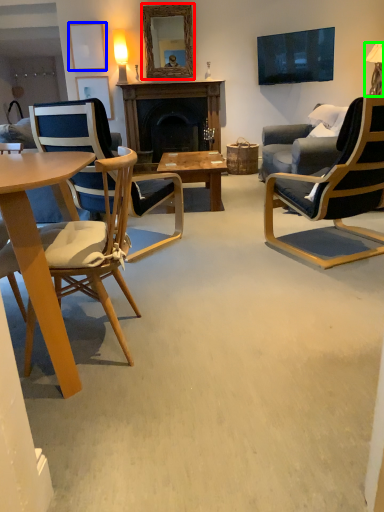
Question: Considering the real-world distances, which object is closest to mirror (highlighted by a red box)? picture frame (highlighted by a blue box) or lamp (highlighted by a green box).

Choices:
 (A) picture frame
 (B) lamp

Answer: (A)